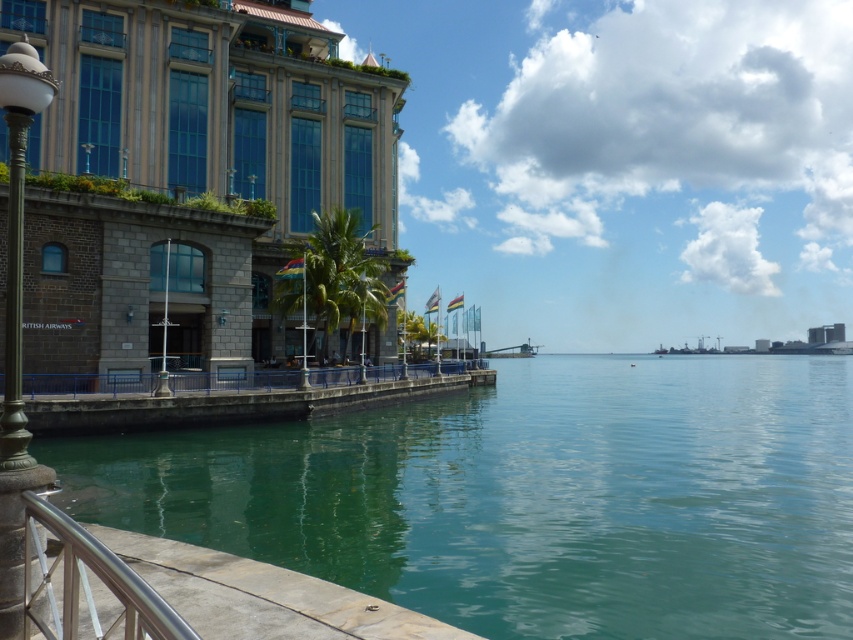
Is satin silver railing at lower left positioned behind bronze textured lamp post at left?

No, it is in front of bronze textured lamp post at left.

Is satin silver railing at lower left below bronze textured lamp post at left?

Correct, satin silver railing at lower left is located below bronze textured lamp post at left.

The width and height of the screenshot is (853, 640). What are the coordinates of `satin silver railing at lower left` in the screenshot? It's located at (189, 592).

Who is shorter, green translucent water at center or bronze textured lamp post at left?

With less height is green translucent water at center.

Can you confirm if green translucent water at center is positioned to the left of bronze textured lamp post at left?

No, green translucent water at center is not to the left of bronze textured lamp post at left.

Identify the location of green translucent water at center. (531, 497).

Locate an element on the screen. green translucent water at center is located at coordinates (531, 497).

Who is positioned more to the left, green translucent water at center or satin silver railing at lower left?

satin silver railing at lower left

Does green translucent water at center have a larger size compared to satin silver railing at lower left?

Yes, green translucent water at center is bigger than satin silver railing at lower left.

Locate an element on the screen. This screenshot has width=853, height=640. green translucent water at center is located at coordinates (531, 497).

Image resolution: width=853 pixels, height=640 pixels. What are the coordinates of `green translucent water at center` in the screenshot? It's located at (531, 497).